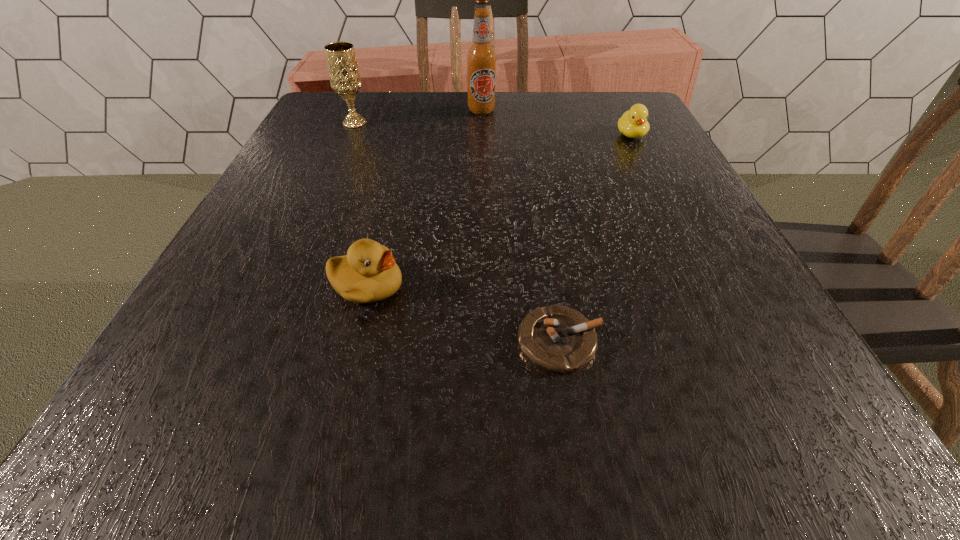
Image resolution: width=960 pixels, height=540 pixels. I want to click on free space between the left duckling and the farther duckling, so click(499, 211).

At what (x,y) coordinates should I click in order to perform the action: click on vacant area that lies between the chalice and the shorter duckling. Please return your answer as a coordinate pair (x, y). The width and height of the screenshot is (960, 540). Looking at the image, I should click on (492, 129).

Locate an element on the screen. vacant area that lies between the second object from left to right and the fourth object from left to right is located at coordinates (464, 314).

I want to click on free spot between the nearer duckling and the farther duckling, so click(499, 211).

Where is `vacant area between the fourth object from left to right and the beer bottle`? vacant area between the fourth object from left to right and the beer bottle is located at coordinates (520, 226).

Image resolution: width=960 pixels, height=540 pixels. Find the location of `free area in between the rightmost object and the shortest object`. free area in between the rightmost object and the shortest object is located at coordinates (595, 238).

Where is `free spot between the tallest object and the left duckling`? The width and height of the screenshot is (960, 540). free spot between the tallest object and the left duckling is located at coordinates (424, 198).

The image size is (960, 540). In order to click on unoccupied position between the chalice and the left duckling in this screenshot , I will do `click(361, 205)`.

Locate an element on the screen. This screenshot has width=960, height=540. blank region between the right duckling and the fourth object from right to left is located at coordinates (499, 211).

I want to click on empty space between the fourth shortest object and the second object from left to right, so click(x=361, y=205).